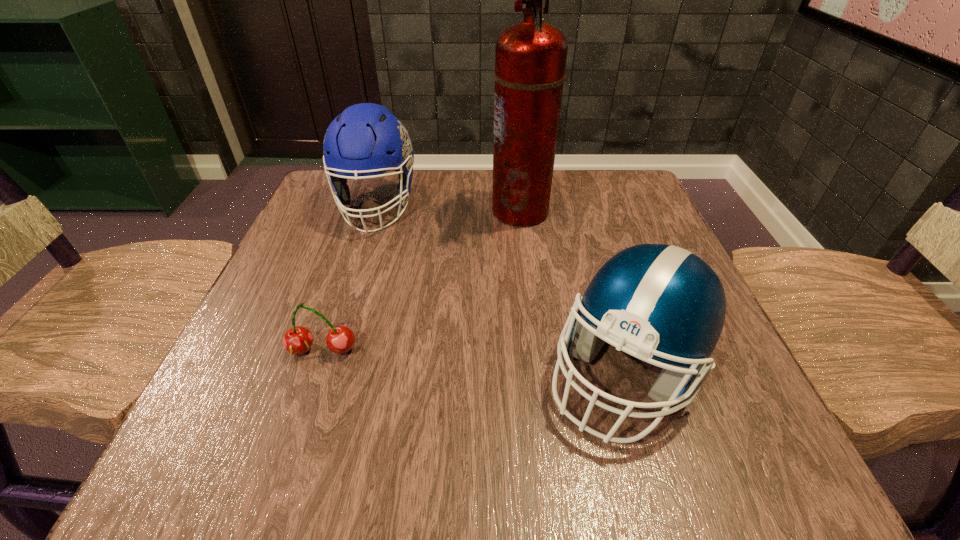
The height and width of the screenshot is (540, 960). I want to click on football helmet that is at the far edge, so click(x=366, y=139).

Where is `object that is at the near edge`? This screenshot has height=540, width=960. object that is at the near edge is located at coordinates (660, 301).

Image resolution: width=960 pixels, height=540 pixels. I want to click on football helmet present at the left edge, so click(366, 139).

Identify the location of cherry at the left edge. The image size is (960, 540). (297, 340).

What are the coordinates of `object at the right edge` in the screenshot? It's located at point(660,301).

The width and height of the screenshot is (960, 540). Identify the location of object located at the far left corner. (366, 139).

Where is `object present at the near right corner`? The height and width of the screenshot is (540, 960). object present at the near right corner is located at coordinates (660, 301).

This screenshot has height=540, width=960. What are the coordinates of `blank area at the far edge` in the screenshot? It's located at (568, 178).

The image size is (960, 540). Find the location of `vacant space at the left edge`. vacant space at the left edge is located at coordinates (314, 232).

Where is `vacant space at the right edge of the desktop`? This screenshot has height=540, width=960. vacant space at the right edge of the desktop is located at coordinates (742, 372).